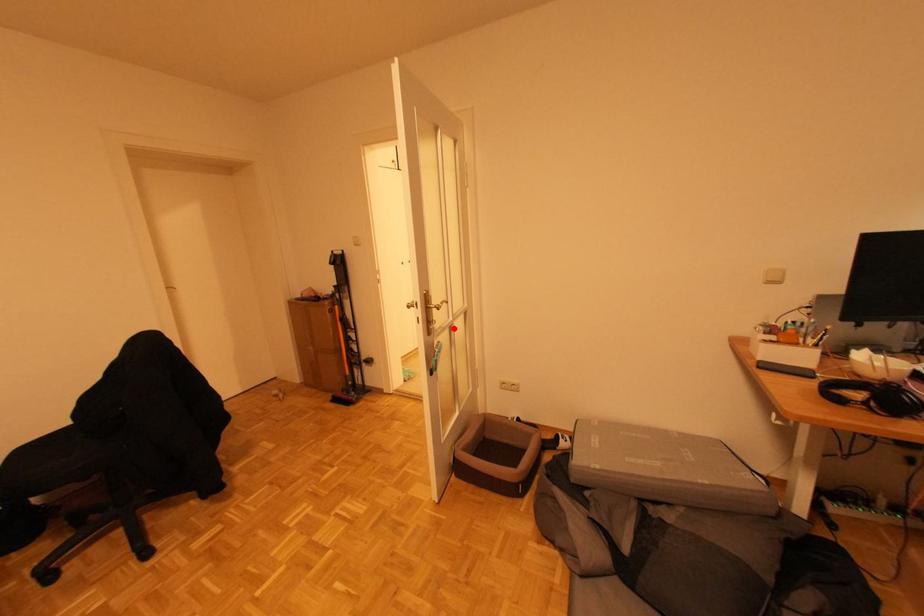
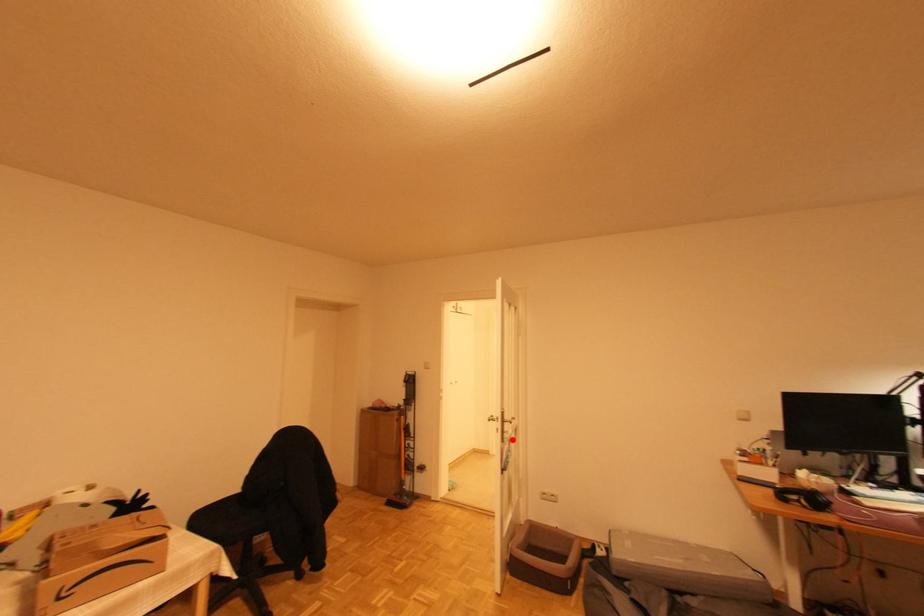
I am providing you with two images of the same scene from different viewpoints. A red point is marked on the first image and another point is marked on the second image. Are the points marked in image1 and image2 representing the same 3D position?

Yes